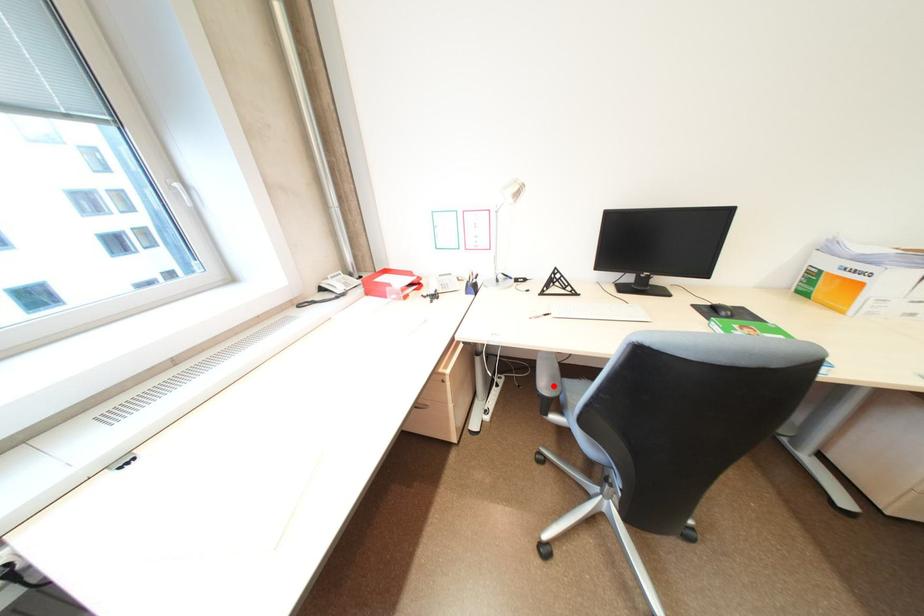
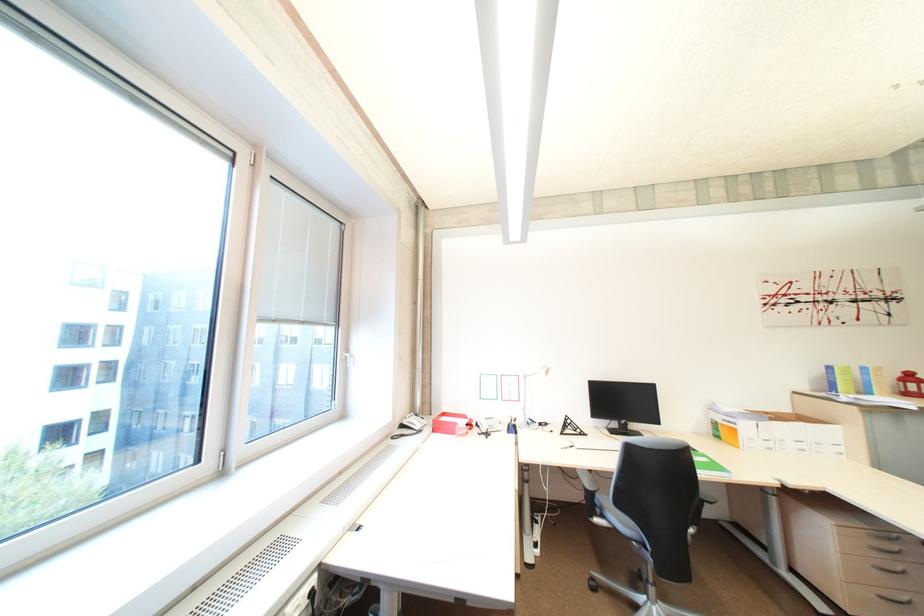
Question: I am providing you with two images of the same scene from different viewpoints. A red point is marked on the first image. Is the red point's position out of view in image 2?

Choices:
 (A) Yes
 (B) No

Answer: (B)